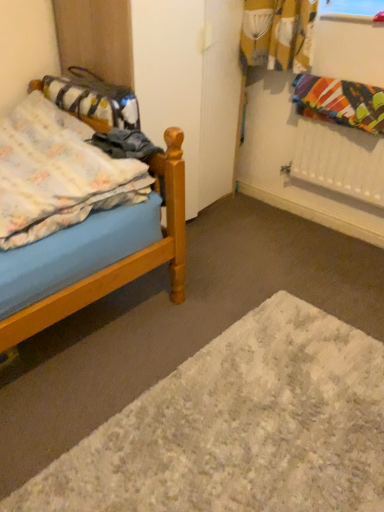
Question: Does fluffy fabric bag at left have a greater width compared to wooden bed at left?

Choices:
 (A) yes
 (B) no

Answer: (B)

Question: Does fluffy fabric bag at left have a lesser height compared to wooden bed at left?

Choices:
 (A) yes
 (B) no

Answer: (A)

Question: From the image's perspective, is fluffy fabric bag at left on wooden bed at left?

Choices:
 (A) yes
 (B) no

Answer: (A)

Question: Is fluffy fabric bag at left aimed at wooden bed at left?

Choices:
 (A) no
 (B) yes

Answer: (B)

Question: Can you confirm if fluffy fabric bag at left is taller than wooden bed at left?

Choices:
 (A) yes
 (B) no

Answer: (B)

Question: Visually, is multicolored fabric at upper right, positioned as the second blanket in left-to-right order, positioned to the left or to the right of white shaggy rug at lower center?

Choices:
 (A) right
 (B) left

Answer: (A)

Question: From their relative heights in the image, would you say multicolored fabric at upper right, positioned as the second blanket in left-to-right order, is taller or shorter than white shaggy rug at lower center?

Choices:
 (A) tall
 (B) short

Answer: (A)

Question: Is multicolored fabric at upper right, positioned as the second blanket in left-to-right order, inside or outside of white shaggy rug at lower center?

Choices:
 (A) outside
 (B) inside

Answer: (A)

Question: From the image's perspective, relative to white shaggy rug at lower center, is multicolored fabric at upper right, positioned as the second blanket in left-to-right order, above or below?

Choices:
 (A) below
 (B) above

Answer: (B)

Question: Is fluffy fabric bag at left in front of or behind white shaggy rug at lower center in the image?

Choices:
 (A) front
 (B) behind

Answer: (B)

Question: Considering the positions of point (69, 104) and point (225, 352), is point (69, 104) closer or farther from the camera than point (225, 352)?

Choices:
 (A) farther
 (B) closer

Answer: (A)

Question: In the image, is fluffy fabric bag at left on the left side or the right side of white shaggy rug at lower center?

Choices:
 (A) left
 (B) right

Answer: (A)

Question: From the image's perspective, is fluffy fabric bag at left located above or below white shaggy rug at lower center?

Choices:
 (A) above
 (B) below

Answer: (A)

Question: Is white shaggy rug at lower center spatially inside fluffy cotton blanket at left, the first blanket when ordered from left to right, or outside of it?

Choices:
 (A) inside
 (B) outside

Answer: (B)

Question: Considering the positions of point (185, 466) and point (114, 190), is point (185, 466) closer or farther from the camera than point (114, 190)?

Choices:
 (A) farther
 (B) closer

Answer: (B)